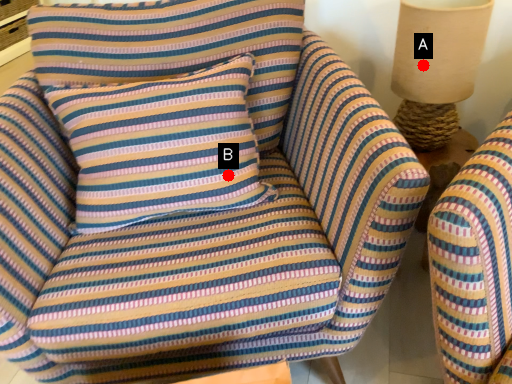
Question: Two points are circled on the image, labeled by A and B beside each circle. Which point appears farthest from the camera in this image?

Choices:
 (A) A is further
 (B) B is further

Answer: (A)